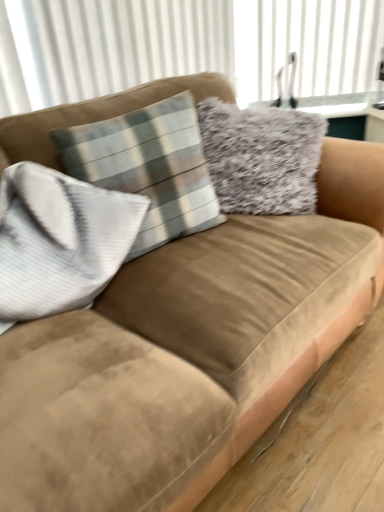
Where is `plaid fabric pillow at upper left`? plaid fabric pillow at upper left is located at coordinates (148, 167).

What do you see at coordinates (148, 167) in the screenshot? This screenshot has height=512, width=384. I see `plaid fabric pillow at upper left` at bounding box center [148, 167].

The height and width of the screenshot is (512, 384). In order to click on plaid fabric pillow at upper left in this screenshot , I will do `click(148, 167)`.